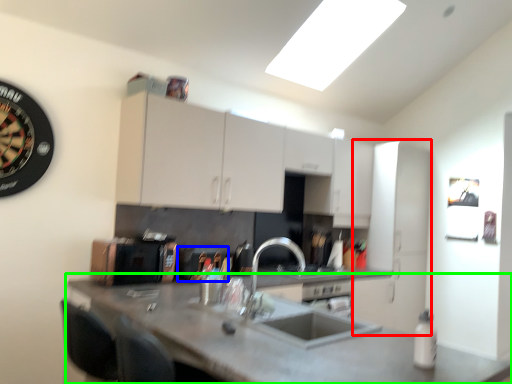
Question: Estimate the real-world distances between objects in this image. Which object is farther from cabinetry (highlighted by a red box), appliance (highlighted by a blue box) or countertop (highlighted by a green box)?

Choices:
 (A) appliance
 (B) countertop

Answer: (B)